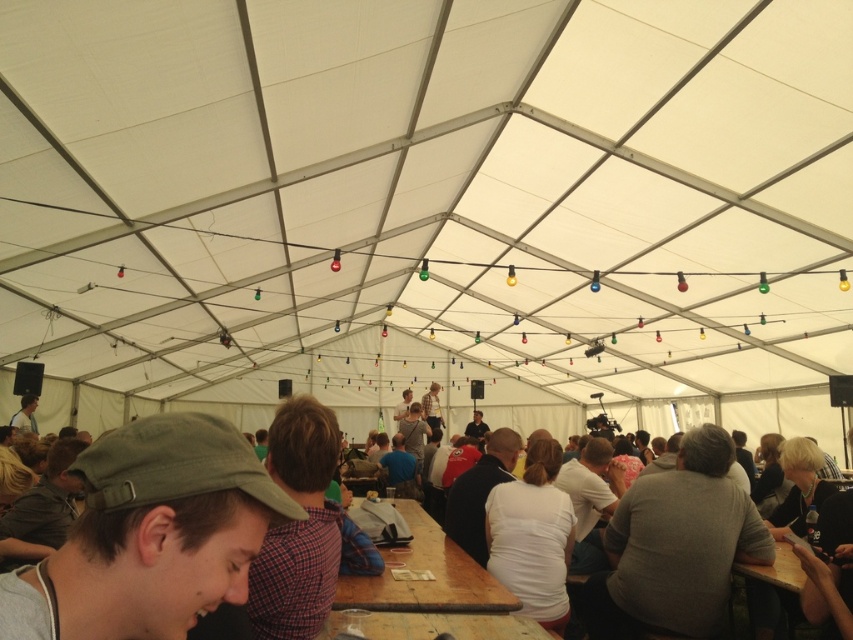
Question: Can you confirm if wooden table at center is thinner than light brown wooden table at center?

Choices:
 (A) no
 (B) yes

Answer: (B)

Question: Which point appears farthest from the camera in this image?

Choices:
 (A) (467, 628)
 (B) (791, 397)
 (C) (436, 524)
 (D) (223, 486)

Answer: (B)

Question: Is gray matte shirt at center to the left of wooden table at lower center from the viewer's perspective?

Choices:
 (A) no
 (B) yes

Answer: (A)

Question: Which point is farther from the camera taking this photo?

Choices:
 (A) (259, 538)
 (B) (479, 589)
 (C) (699, 499)

Answer: (C)

Question: Which point is closer to the camera?

Choices:
 (A) click(9, 600)
 (B) click(467, 576)
 (C) click(396, 611)
 (D) click(642, 496)

Answer: (A)

Question: Can you confirm if green fabric cap at lower left is positioned above wooden table at lower center?

Choices:
 (A) no
 (B) yes

Answer: (B)